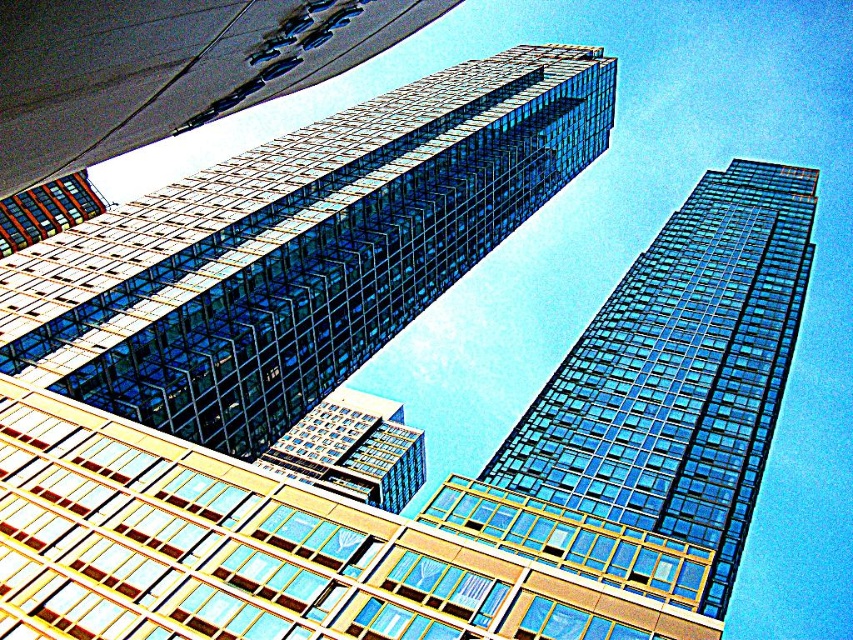
Question: Observing the image, what is the correct spatial positioning of transparent glass building at upper center in reference to clear glass building at center?

Choices:
 (A) below
 (B) above

Answer: (B)

Question: Which object is positioned closest to the clear glass building at center?

Choices:
 (A) transparent glass building at upper center
 (B) transparent glass skyscraper at upper right

Answer: (A)

Question: Among these objects, which one is nearest to the camera?

Choices:
 (A) clear glass building at center
 (B) transparent glass building at upper center
 (C) transparent glass skyscraper at upper right

Answer: (A)

Question: Considering the relative positions of transparent glass building at upper center and clear glass building at center in the image provided, where is transparent glass building at upper center located with respect to clear glass building at center?

Choices:
 (A) right
 (B) left

Answer: (A)

Question: Does transparent glass building at upper center appear under transparent glass skyscraper at upper right?

Choices:
 (A) yes
 (B) no

Answer: (B)

Question: Which point is farther to the camera?

Choices:
 (A) (341, 166)
 (B) (329, 424)
 (C) (730, 179)

Answer: (B)